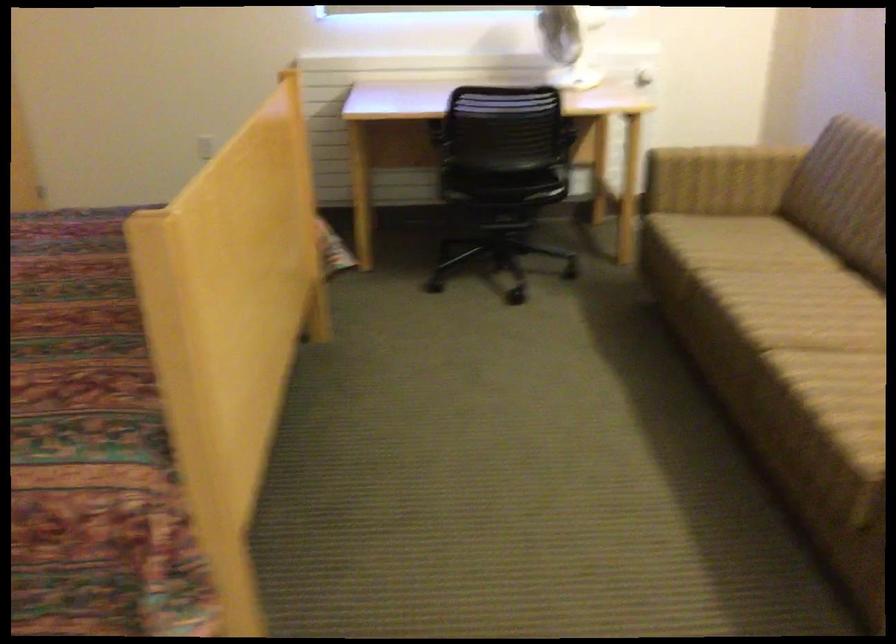
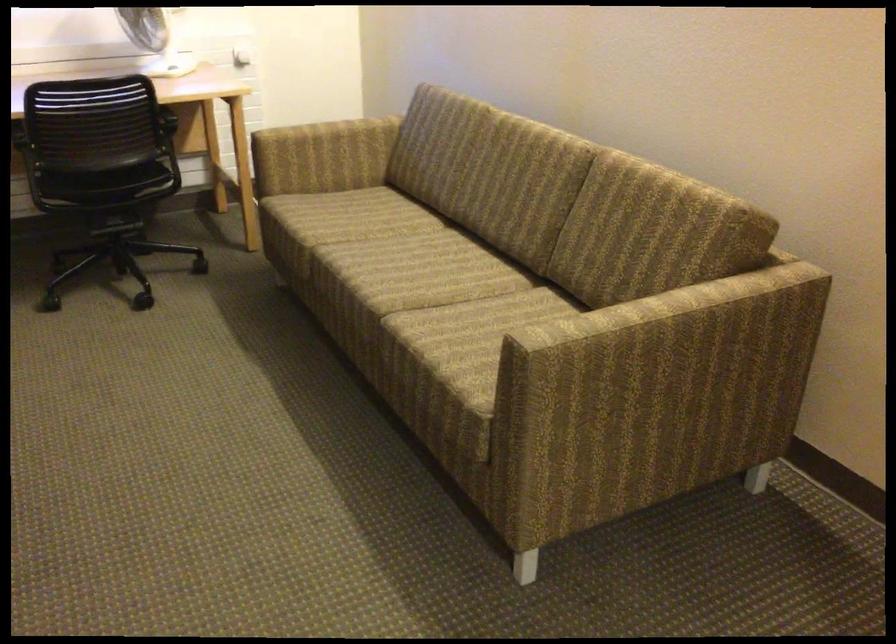
The images are taken continuously from a first-person perspective. In which direction are you moving?

The cameraman moved toward right, backward.